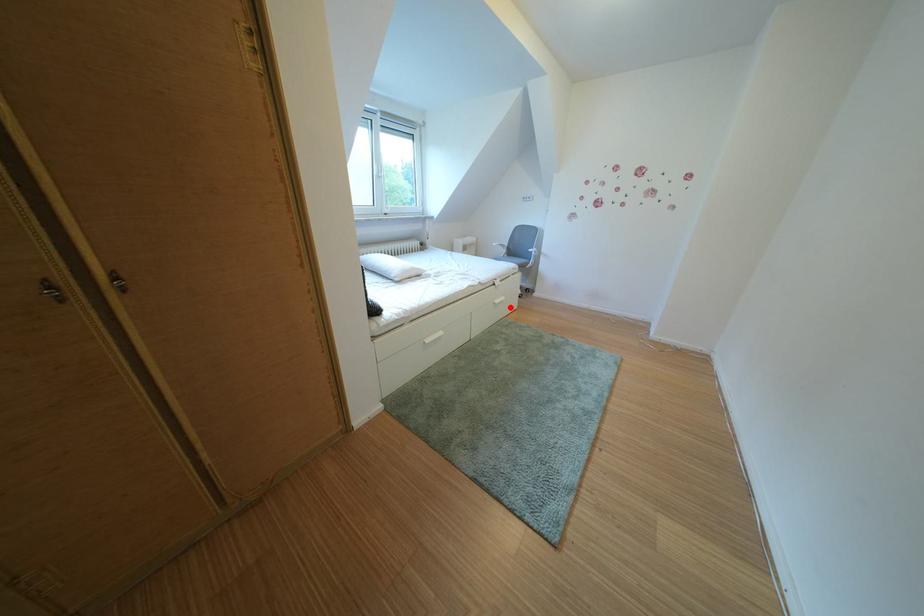
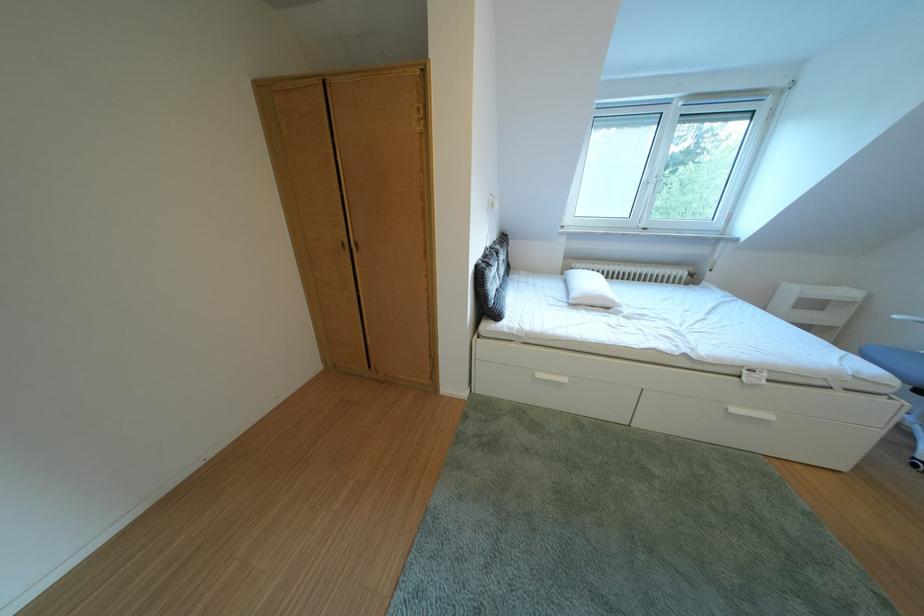
The point at the highlighted location is marked in the first image. Where is the corresponding point in the second image?

(748, 415)